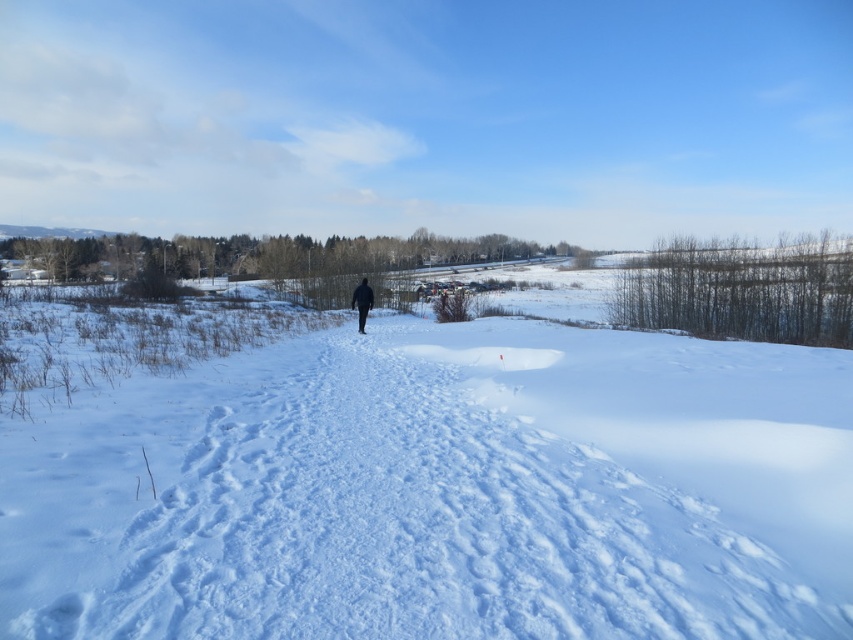
Question: Which of the following is the farthest from the observer?

Choices:
 (A) (351, 304)
 (B) (288, 484)

Answer: (A)

Question: Can you confirm if white fluffy snow at center is positioned below dark blue jacket at center?

Choices:
 (A) no
 (B) yes

Answer: (B)

Question: Which point is closer to the camera?

Choices:
 (A) (355, 291)
 (B) (553, 456)

Answer: (B)

Question: Can you confirm if white fluffy snow at center is thinner than dark blue jacket at center?

Choices:
 (A) yes
 (B) no

Answer: (B)

Question: Observing the image, what is the correct spatial positioning of white fluffy snow at center in reference to dark blue jacket at center?

Choices:
 (A) right
 (B) left

Answer: (A)

Question: Which point appears closest to the camera in this image?

Choices:
 (A) (115, 531)
 (B) (358, 308)

Answer: (A)